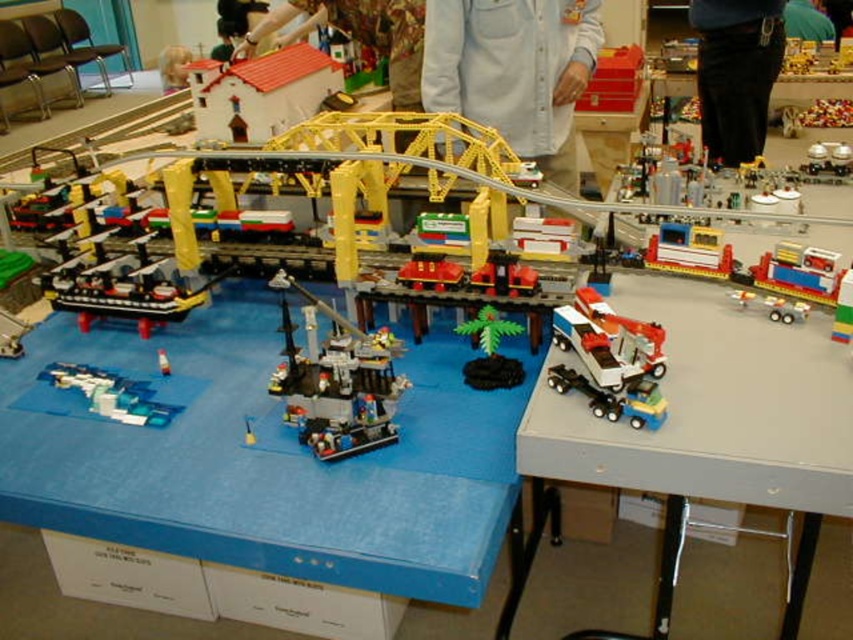
Question: Is black pants at lower right bigger than smooth white house at upper left?

Choices:
 (A) yes
 (B) no

Answer: (B)

Question: Is light blue fabric shirt at upper center bigger than shiny blue plastic airplane at lower left?

Choices:
 (A) yes
 (B) no

Answer: (A)

Question: Considering the real-world distances, which object is farthest from the white plastic truck at right?

Choices:
 (A) light blue fabric shirt at upper center
 (B) metallic silver truck at right
 (C) green matte palm tree at center

Answer: (A)

Question: In this image, where is white plastic truck at right located relative to yellow metallic bridge at upper center?

Choices:
 (A) right
 (B) left

Answer: (A)

Question: Estimate the real-world distances between objects in this image. Which object is closer to the black plastic ship at center?

Choices:
 (A) blue matte table at center
 (B) yellow metallic bridge at upper center
 (C) smooth white house at upper left
 (D) white plastic train at right

Answer: (A)

Question: Which point is farther to the camera?

Choices:
 (A) blue matte table at center
 (B) black plastic ship at center
 (C) yellow metallic bridge at upper center
 (D) green matte palm tree at center

Answer: (C)